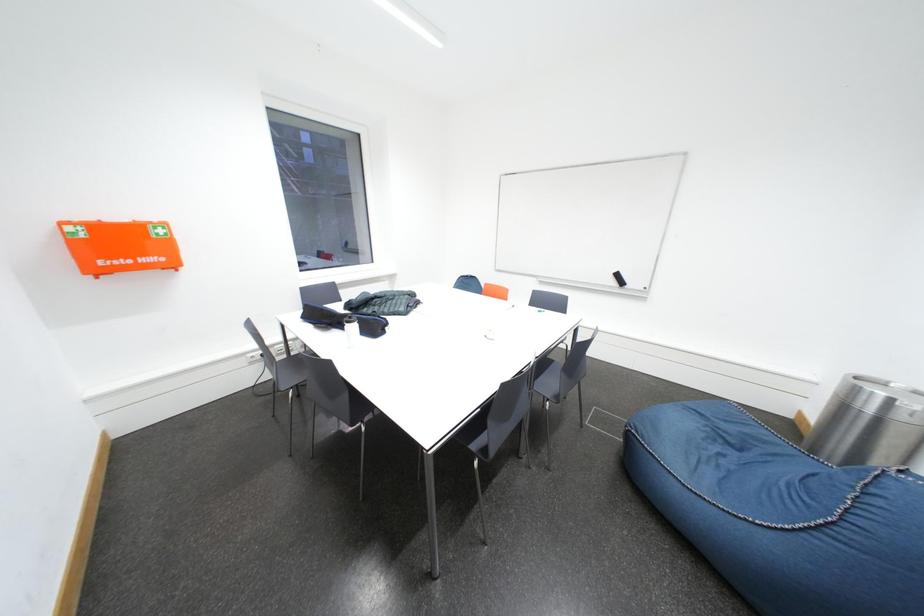
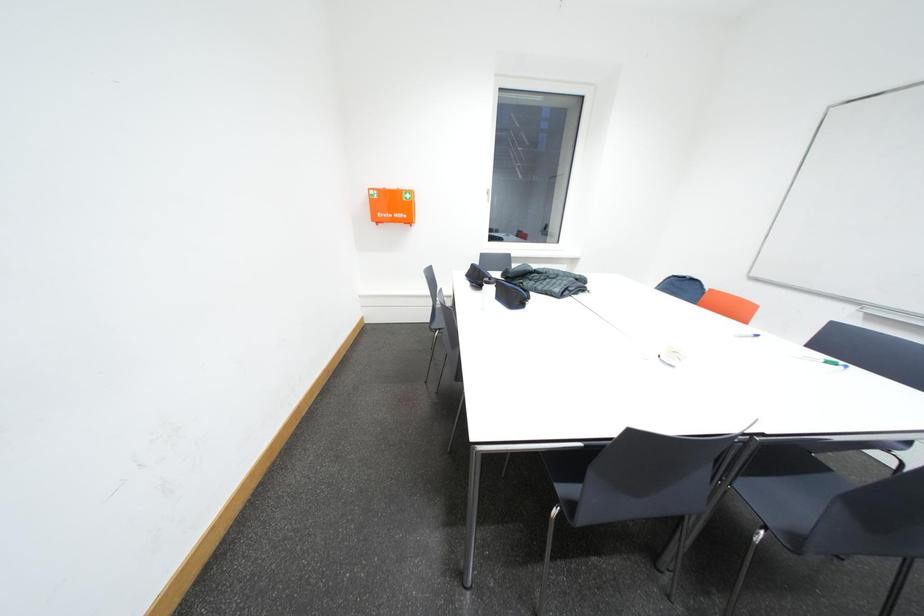
Question: How did the camera likely rotate?

Choices:
 (A) Left
 (B) Right
 (C) Up
 (D) Down

Answer: (A)